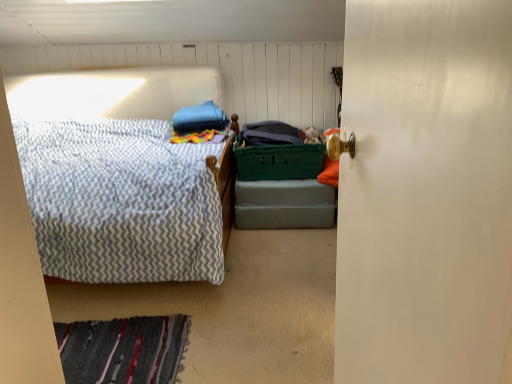
Find the location of a particular element. free space in front of green plastic crate at center is located at coordinates (282, 243).